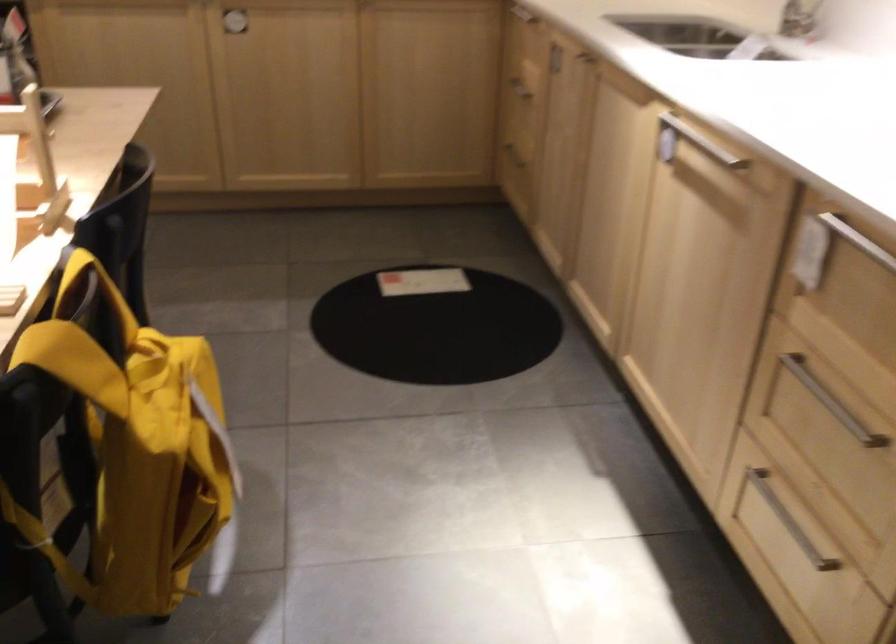
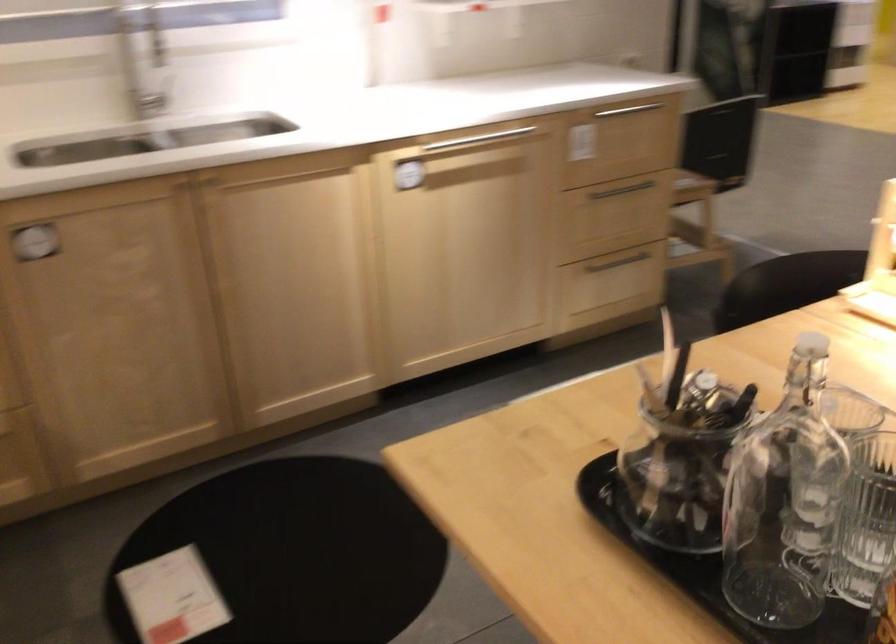
In the second image, find the point that corresponds to point (426, 314) in the first image.

(295, 553)